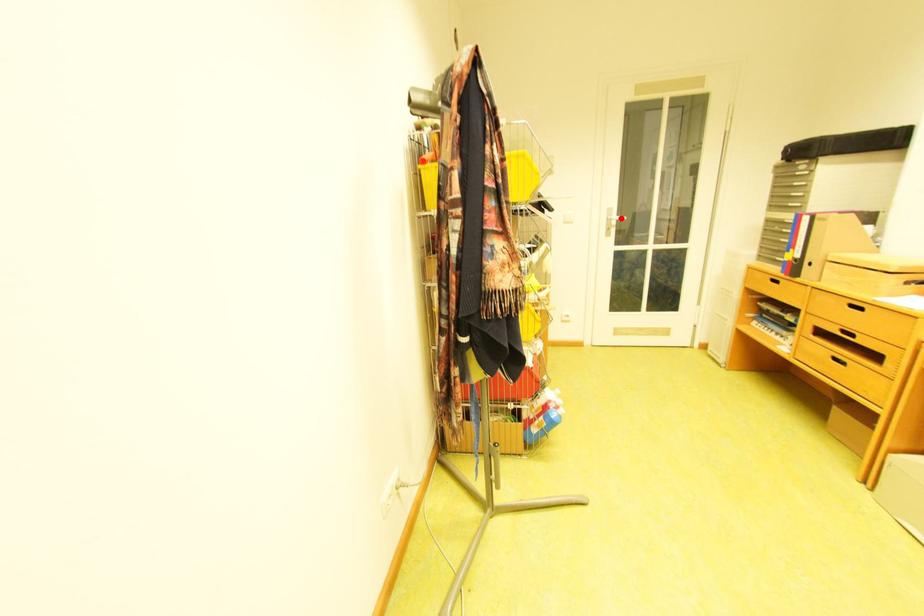
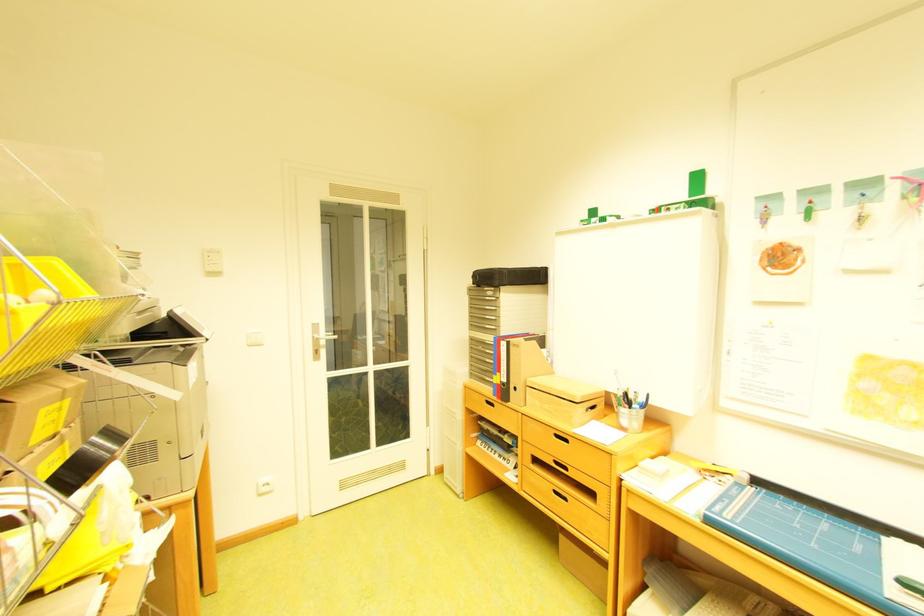
Question: A red point is marked in image1. In image2, is the corresponding 3D point closer to the camera or farther? Reply with the corresponding letter.

Choices:
 (A) The corresponding 3D point is closer.
 (B) The corresponding 3D point is farther.

Answer: (A)